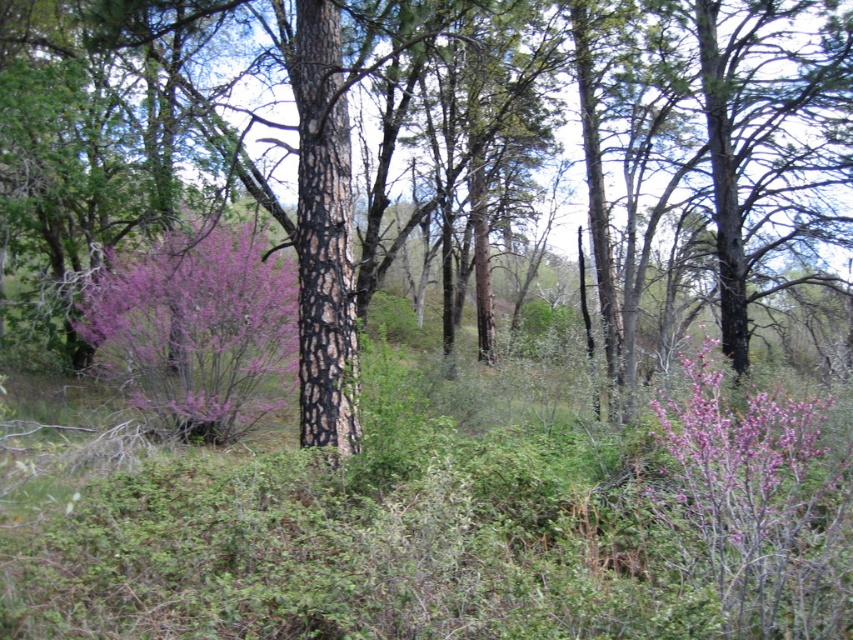
Question: Considering the relative positions of brown rough bark tree at center and purple matte bush at left in the image provided, where is brown rough bark tree at center located with respect to purple matte bush at left?

Choices:
 (A) right
 (B) left

Answer: (A)

Question: Among these objects, which one is farthest from the camera?

Choices:
 (A) purple bloom at right
 (B) purple matte bush at left

Answer: (B)

Question: Does brown rough bark tree at center appear over purple matte bush at left?

Choices:
 (A) yes
 (B) no

Answer: (A)

Question: Can you confirm if brown rough bark tree at center is bigger than purple matte bush at left?

Choices:
 (A) yes
 (B) no

Answer: (A)

Question: Which point is closer to the camera taking this photo?

Choices:
 (A) (770, 483)
 (B) (193, 307)

Answer: (A)

Question: Based on their relative distances, which object is nearer to the purple bloom at right?

Choices:
 (A) brown rough bark tree at center
 (B) purple matte bush at left

Answer: (B)